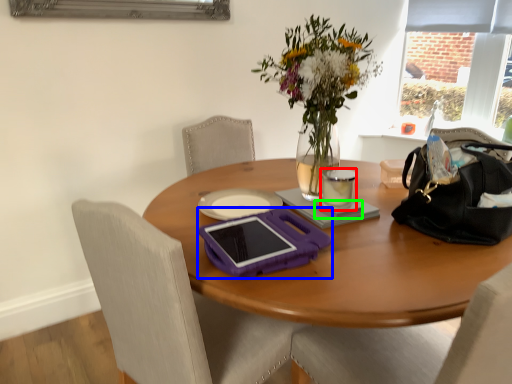
Question: Which is nearer to the coffee cup (highlighted by a red box)? tablet computer (highlighted by a blue box) or notepad (highlighted by a green box).

Choices:
 (A) tablet computer
 (B) notepad

Answer: (B)